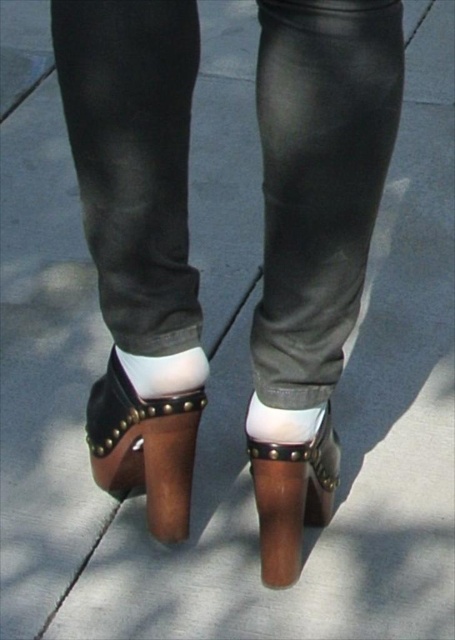
Which is in front, point (288, 477) or point (195, 388)?

Point (288, 477)

Does brown leather shoe at center have a greater height compared to white smooth socks at center?

Correct, brown leather shoe at center is much taller as white smooth socks at center.

The width and height of the screenshot is (455, 640). Describe the element at coordinates (292, 497) in the screenshot. I see `brown leather shoe at center` at that location.

Image resolution: width=455 pixels, height=640 pixels. I want to click on brown leather shoe at center, so click(292, 497).

Identify the location of brown leather shoe at center. (292, 497).

Who is positioned more to the right, brown leather sandal at center or brown leather shoe at center?

brown leather shoe at center

Who is more distant from viewer, [147,484] or [272,516]?

The point [147,484] is more distant.

This screenshot has width=455, height=640. In order to click on brown leather sandal at center in this screenshot , I will do `click(145, 448)`.